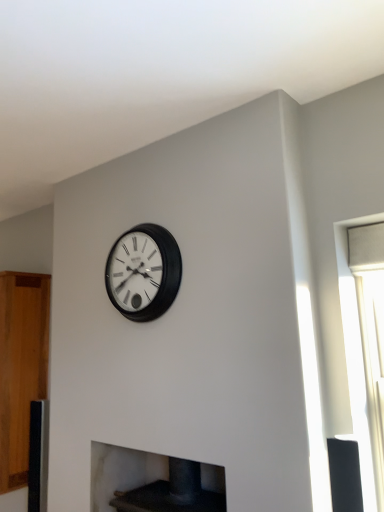
Question: Can dark gray stone fireplace at lower center be found inside matte black clock at center?

Choices:
 (A) no
 (B) yes

Answer: (A)

Question: Does matte black clock at center have a lesser width compared to dark gray stone fireplace at lower center?

Choices:
 (A) yes
 (B) no

Answer: (A)

Question: Does matte black clock at center have a greater width compared to dark gray stone fireplace at lower center?

Choices:
 (A) no
 (B) yes

Answer: (A)

Question: Is matte black clock at center to the right of dark gray stone fireplace at lower center from the viewer's perspective?

Choices:
 (A) yes
 (B) no

Answer: (B)

Question: Is matte black clock at center further to the viewer compared to dark gray stone fireplace at lower center?

Choices:
 (A) no
 (B) yes

Answer: (B)

Question: Does matte black clock at center come in front of dark gray stone fireplace at lower center?

Choices:
 (A) no
 (B) yes

Answer: (A)

Question: Can you confirm if matte black clock at center is taller than wooden cabinet at left?

Choices:
 (A) no
 (B) yes

Answer: (A)

Question: Is matte black clock at center to the left of wooden cabinet at left from the viewer's perspective?

Choices:
 (A) yes
 (B) no

Answer: (B)

Question: Does matte black clock at center turn towards wooden cabinet at left?

Choices:
 (A) yes
 (B) no

Answer: (B)

Question: From a real-world perspective, is matte black clock at center positioned under wooden cabinet at left based on gravity?

Choices:
 (A) no
 (B) yes

Answer: (A)

Question: Does matte black clock at center have a larger size compared to wooden cabinet at left?

Choices:
 (A) yes
 (B) no

Answer: (B)

Question: Would you say wooden cabinet at left is part of matte black clock at center's contents?

Choices:
 (A) no
 (B) yes

Answer: (A)

Question: Is dark gray stone fireplace at lower center wider than wooden cabinet at left?

Choices:
 (A) yes
 (B) no

Answer: (B)